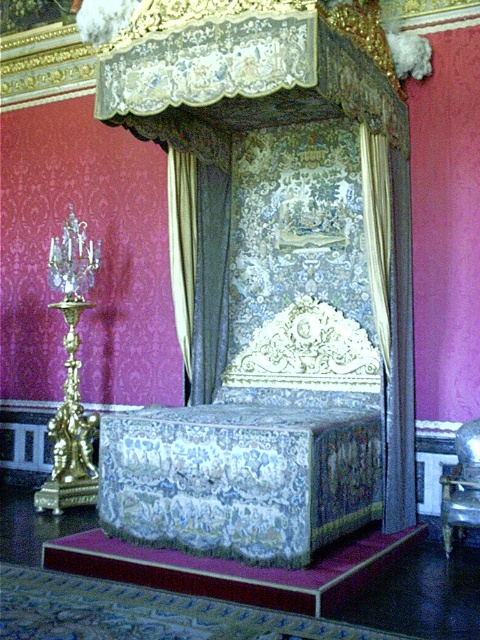
The image size is (480, 640). What do you see at coordinates (376, 230) in the screenshot?
I see `silky white curtain at right` at bounding box center [376, 230].

From the picture: Who is taller, silky white curtain at right or metallic silver bed at center?

With more height is silky white curtain at right.

Which is behind, point (386, 352) or point (471, 525)?

The point (386, 352) is behind.

Identify the location of silky white curtain at right. Image resolution: width=480 pixels, height=640 pixels. [x=376, y=230].

I want to click on silky gold curtain at center, so pos(199,268).

Is silky gold curtain at center shorter than silky beige curtain at center?

Incorrect, silky gold curtain at center's height does not fall short of silky beige curtain at center's.

Is point (196, 180) closer to camera compared to point (182, 208)?

No, it is behind (182, 208).

You are a GUI agent. You are given a task and a screenshot of the screen. Output one action in this format:
    pyautogui.click(x=<x>, y=<y>)
    Task: Click on the silky gold curtain at center
    This screenshot has height=640, width=480.
    Given the screenshot: What is the action you would take?
    pyautogui.click(x=199, y=268)

Does silky blue fabric bed at center have a greater height compared to silky gold curtain at center?

No, silky blue fabric bed at center is not taller than silky gold curtain at center.

Can you confirm if silky blue fabric bed at center is positioned to the right of silky gold curtain at center?

Correct, you'll find silky blue fabric bed at center to the right of silky gold curtain at center.

Image resolution: width=480 pixels, height=640 pixels. Describe the element at coordinates (257, 442) in the screenshot. I see `silky blue fabric bed at center` at that location.

This screenshot has width=480, height=640. Identify the location of silky blue fabric bed at center. (257, 442).